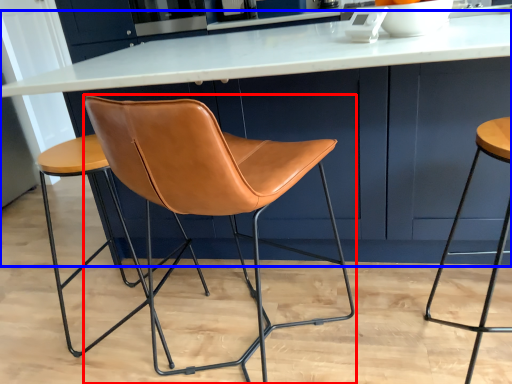
Question: Which object is closer to the camera taking this photo, chair (highlighted by a red box) or table (highlighted by a blue box)?

Choices:
 (A) chair
 (B) table

Answer: (A)